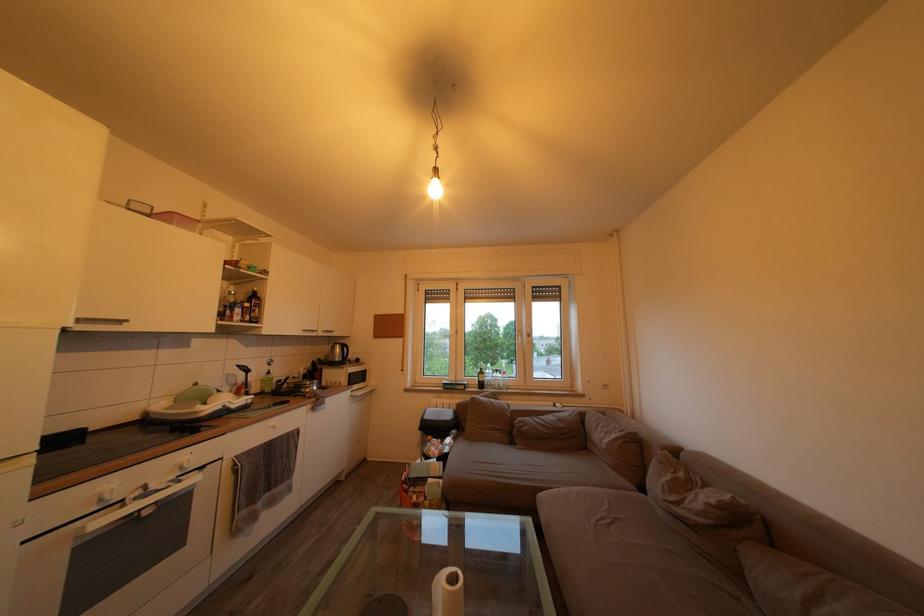
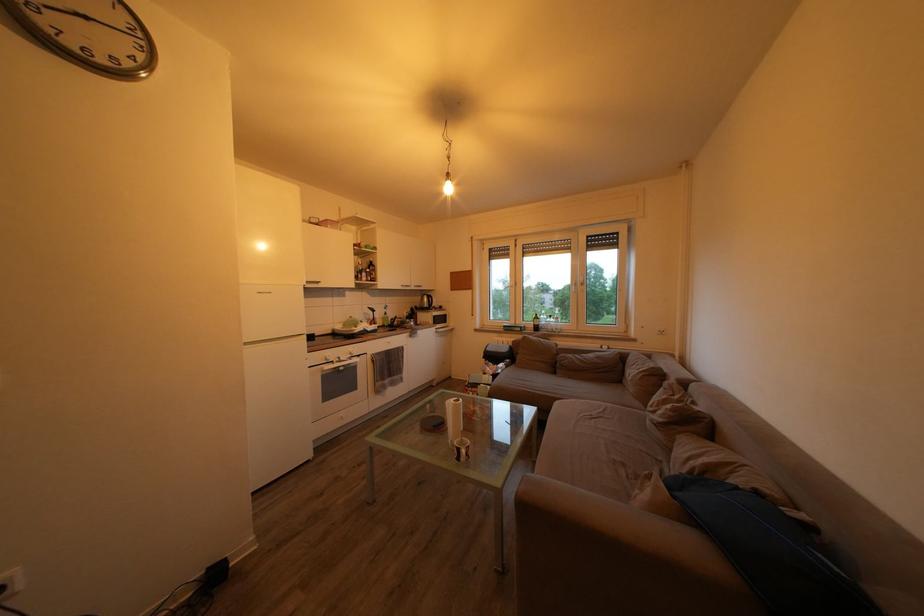
Question: How did the camera likely rotate?

Choices:
 (A) Left
 (B) Right
 (C) Up
 (D) Down

Answer: (A)